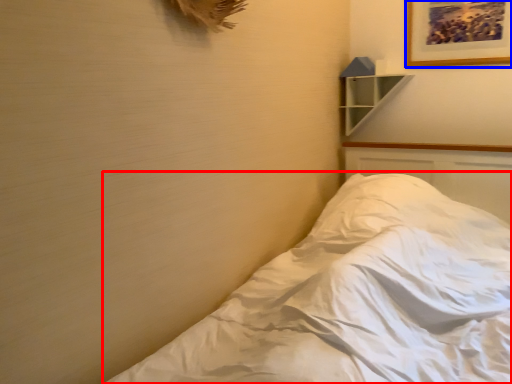
Question: Which object appears farthest to the camera in this image, bed (highlighted by a red box) or picture frame (highlighted by a blue box)?

Choices:
 (A) bed
 (B) picture frame

Answer: (B)